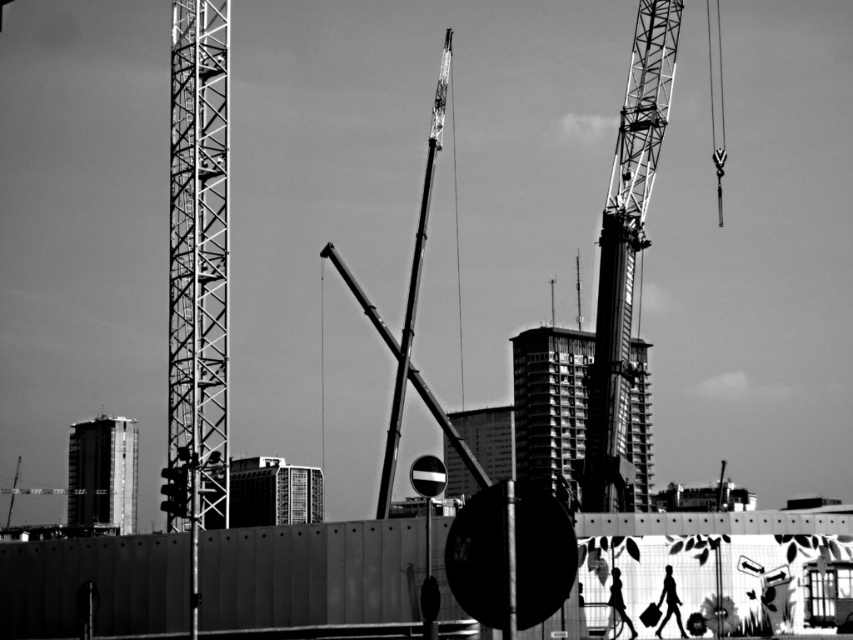
You are a drone operator tasked with capturing aerial footage of the construction site. Your drone must fly from the temporary fence in the foreground to the metallic industrial crane at center. According to the coordinates provided, what is the shortest horizontal distance your drone needs to cover to reach the crane from the fence?

The metallic industrial crane at center is located at coordinates point (410, 316). The shortest horizontal distance would depend on the specific location on the fence from which the drone starts, but the coordinates indicate its central position, so the drone should aim for that point to minimize travel distance.

Consider the image. Based on the scene description, which object is positioned higher in the image? Please consider the metallic industrial crane at center and the smooth glass building at center.

The metallic industrial crane at center is located above the smooth glass building at center, so it is positioned higher in the image.